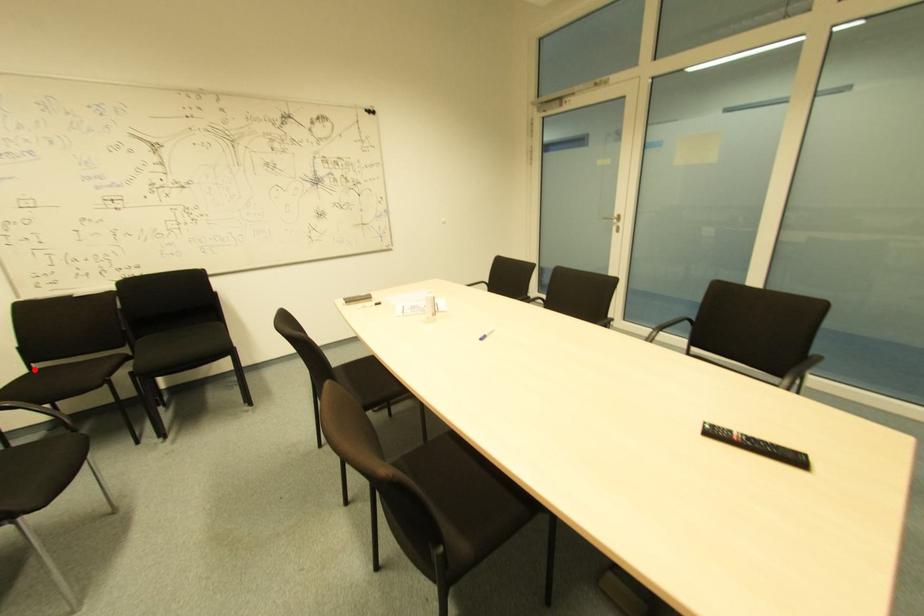
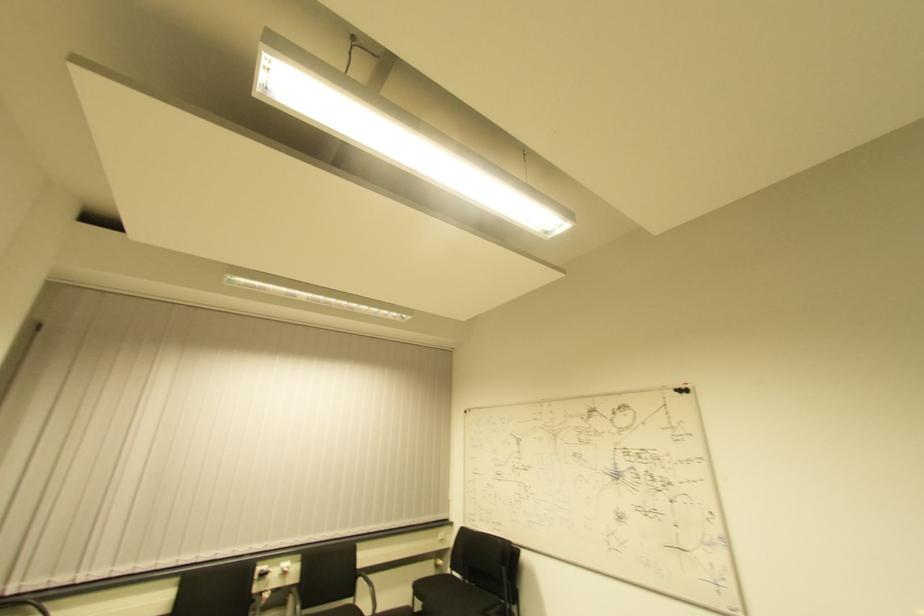
Question: I am providing you with two images of the same scene from different viewpoints. A red point is shown in image1. For the corresponding object point in image2, is it positioned nearer or farther from the camera?

Choices:
 (A) Nearer
 (B) Farther

Answer: (A)